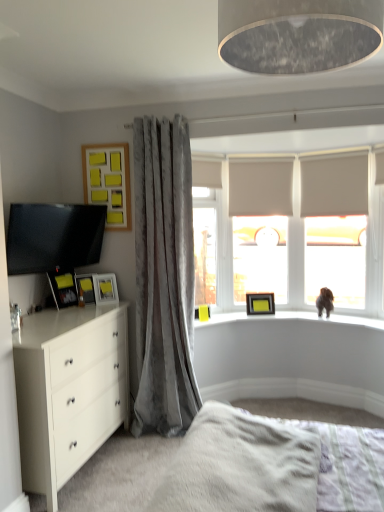
The height and width of the screenshot is (512, 384). Identify the location of free location in front of matte yellow picture frame at left, which appears as the 4th picture frame when viewed from the back. (80, 309).